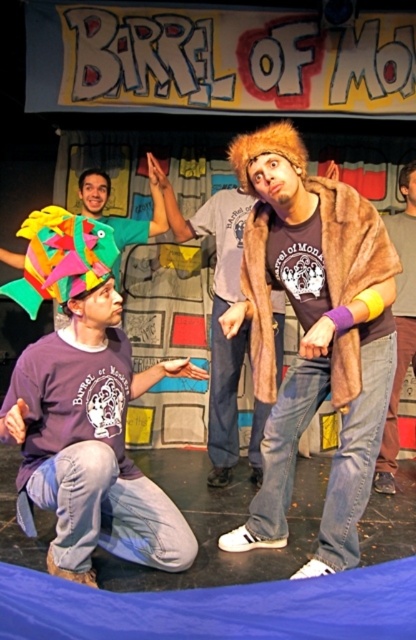
Is point (51, 220) less distant than point (218, 216)?

Yes.

Is purple cotton shirt at lower left above fur coat at center?

No.

This screenshot has height=640, width=416. What do you see at coordinates (86, 412) in the screenshot?
I see `purple cotton shirt at lower left` at bounding box center [86, 412].

I want to click on purple cotton shirt at lower left, so click(86, 412).

Can you confirm if fuzzy brown coat at center is positioned above purple cotton shirt at lower left?

Yes, fuzzy brown coat at center is above purple cotton shirt at lower left.

Who is higher up, fuzzy brown coat at center or purple cotton shirt at lower left?

fuzzy brown coat at center is above.

Is point (324, 182) closer to viewer compared to point (59, 525)?

That is False.

I want to click on fuzzy brown coat at center, so click(x=314, y=336).

Where is `fuzzy brown coat at center`? fuzzy brown coat at center is located at coordinates (314, 336).

Is point (371, 259) behind point (398, 250)?

No, (371, 259) is closer to viewer.

At what (x,y) coordinates should I click in order to perform the action: click on fuzzy brown coat at center. Please return your answer as a coordinate pair (x, y). Looking at the image, I should click on (314, 336).